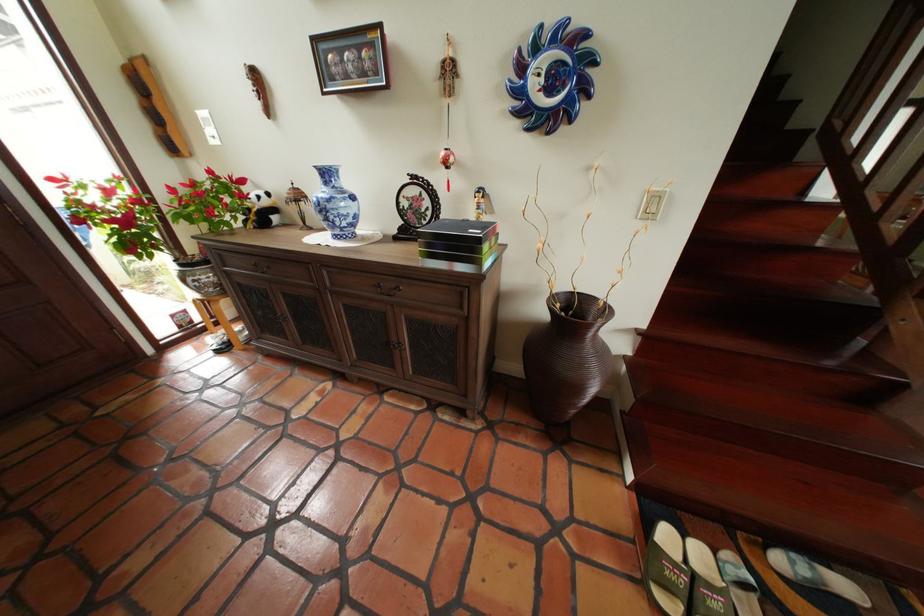
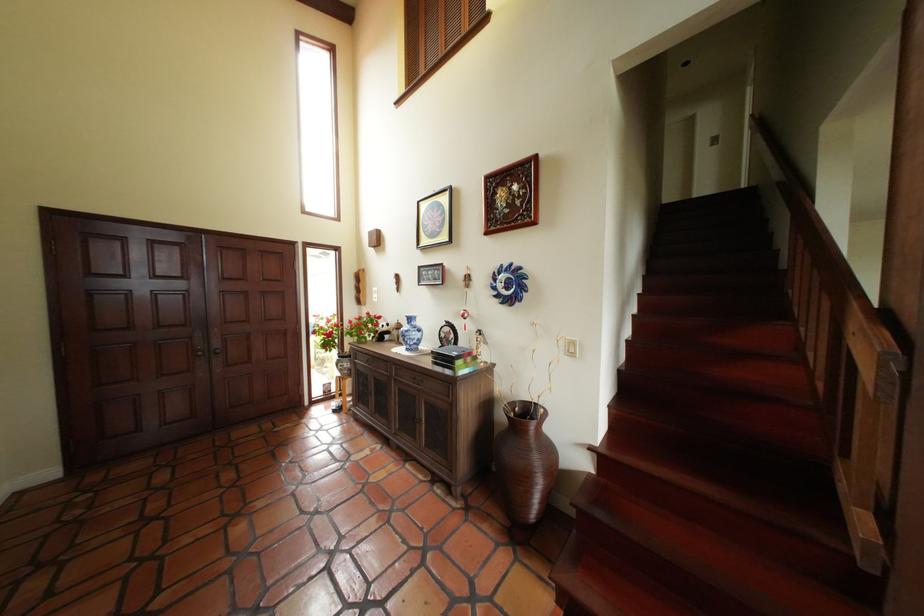
Locate, in the second image, the point that corresponds to point 442,246 in the first image.

(448, 360)